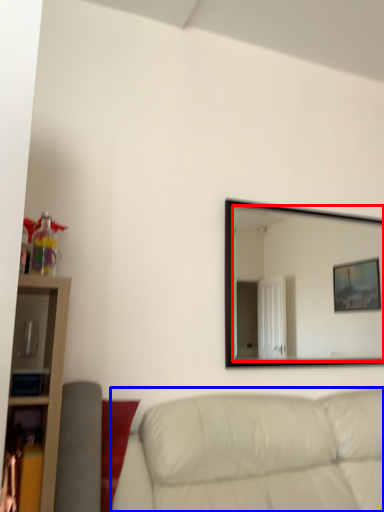
Question: Which point is further to the camera, mirror (highlighted by a red box) or studio couch (highlighted by a blue box)?

Choices:
 (A) mirror
 (B) studio couch

Answer: (A)